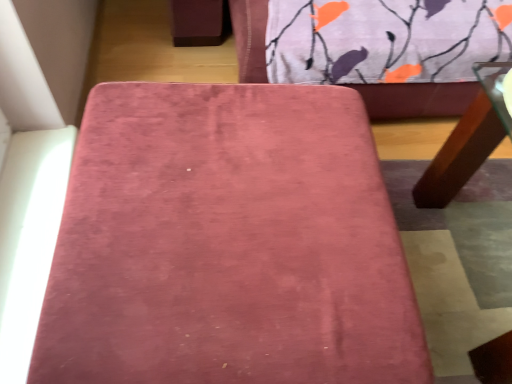
Where is `vacant area on top of velvet-like pink ottoman at center (from a real-world perspective)`? vacant area on top of velvet-like pink ottoman at center (from a real-world perspective) is located at coordinates (232, 197).